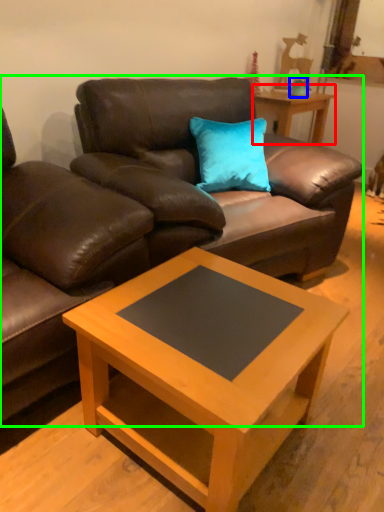
Question: Which is farther away from table (highlighted by a red box)? teal (highlighted by a blue box) or studio couch (highlighted by a green box)?

Choices:
 (A) teal
 (B) studio couch

Answer: (B)